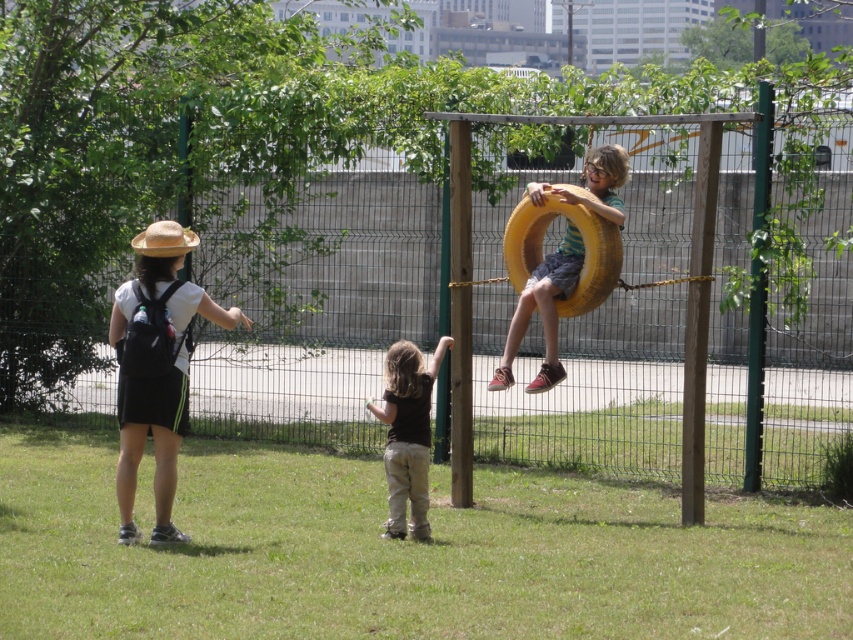
You are a parent at the playground. You see the brown cotton shirt at center and the yellow rubber tire at center. Which object is closer to you?

The yellow rubber tire at center is closer to you because the brown cotton shirt at center is behind it.

You are a visitor at the park and want to take a photo of the straw hat at left and the yellow rubber tire at center. To ensure both are in the frame, which object should you position closer to the camera?

The straw hat at left is positioned under the yellow rubber tire at center, so you should position the yellow rubber tire at center closer to the camera to ensure both are visible in the frame.